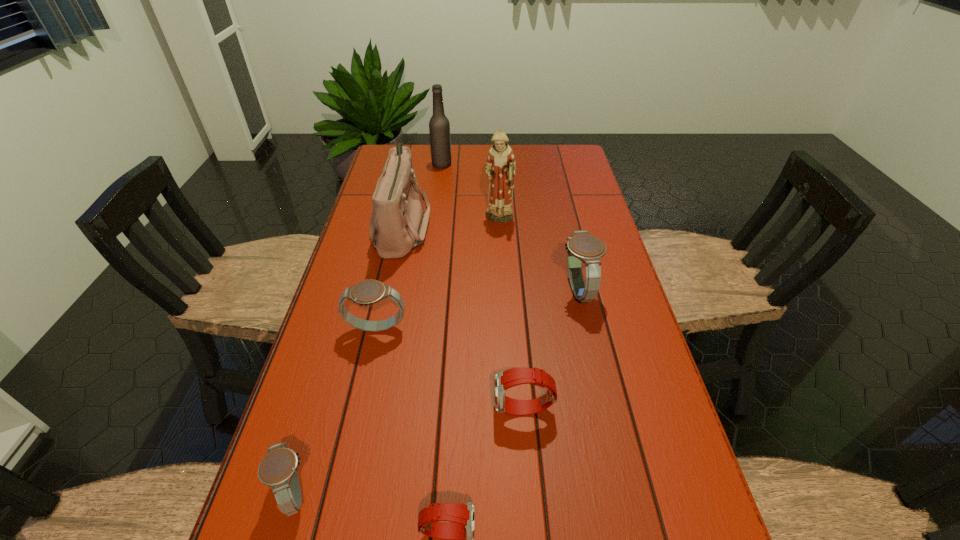
The height and width of the screenshot is (540, 960). Identify the location of object situated at the right edge. (582, 246).

You are a GUI agent. You are given a task and a screenshot of the screen. Output one action in this format:
    pyautogui.click(x=<x>, y=<y>)
    Task: Click on the vacant space at the far edge
    The height and width of the screenshot is (540, 960).
    Given the screenshot: What is the action you would take?
    pyautogui.click(x=521, y=160)

The width and height of the screenshot is (960, 540). Find the location of `vacant space at the left edge`. vacant space at the left edge is located at coordinates (352, 424).

This screenshot has width=960, height=540. I want to click on free space at the right edge of the desktop, so click(x=612, y=316).

The width and height of the screenshot is (960, 540). Find the location of `unoccupied position between the smallest gray watch and the shoulder bag`. unoccupied position between the smallest gray watch and the shoulder bag is located at coordinates (348, 360).

Find the location of `free space between the tallest watch and the nearest gray watch`. free space between the tallest watch and the nearest gray watch is located at coordinates (436, 392).

I want to click on free space between the nearest gray watch and the second smallest gray watch, so 336,411.

Where is `empty space that is in between the right red watch and the figurine`? Image resolution: width=960 pixels, height=540 pixels. empty space that is in between the right red watch and the figurine is located at coordinates (512, 315).

Select which object is the fourth closest to the shoulder bag. Please provide its 2D coordinates. Your answer should be formatted as a tuple, i.e. [(x, y)], where the tuple contains the x and y coordinates of a point satisfying the conditions above.

[(582, 246)]

I want to click on object identified as the seventh closest to the third watch from left to right, so click(439, 127).